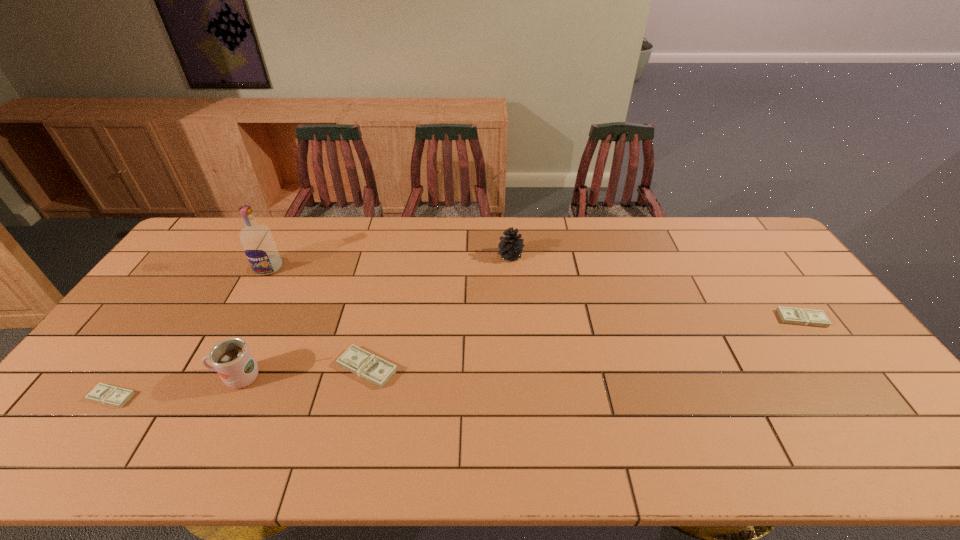
Identify the location of cup that is at the near edge. (232, 360).

This screenshot has width=960, height=540. Find the location of `object that is at the left edge`. object that is at the left edge is located at coordinates (110, 395).

Where is `object present at the right edge`? This screenshot has height=540, width=960. object present at the right edge is located at coordinates (800, 316).

At what (x,y) coordinates should I click in order to perform the action: click on object that is at the near left corner. Please return your answer as a coordinate pair (x, y). The image size is (960, 540). Looking at the image, I should click on (110, 395).

You are a GUI agent. You are given a task and a screenshot of the screen. Output one action in this format:
    pyautogui.click(x=<x>, y=<y>)
    Task: Click on the blank space at the far edge
    This screenshot has height=540, width=960.
    Given the screenshot: What is the action you would take?
    pyautogui.click(x=697, y=225)

Where is `vacant area at the near edge`? The width and height of the screenshot is (960, 540). vacant area at the near edge is located at coordinates pos(204,394).

You are a GUI agent. You are given a task and a screenshot of the screen. Output one action in this format:
    pyautogui.click(x=<x>, y=<y>)
    Task: Click on the vacant region at the right edge of the desktop
    
    Given the screenshot: What is the action you would take?
    pyautogui.click(x=815, y=302)

Identify the location of free area in between the tallest object and the fifth shortest object. This screenshot has width=960, height=540. (253, 323).

Identify the location of unoccupied area between the leftmost object and the fifth object from left to right. (311, 326).

You are a GUI agent. You are given a task and a screenshot of the screen. Output one action in this format:
    pyautogui.click(x=<x>, y=<y>)
    Task: Click on the free space between the tallest object and the fifth object from left to right
    The height and width of the screenshot is (540, 960).
    Given the screenshot: What is the action you would take?
    pyautogui.click(x=390, y=262)